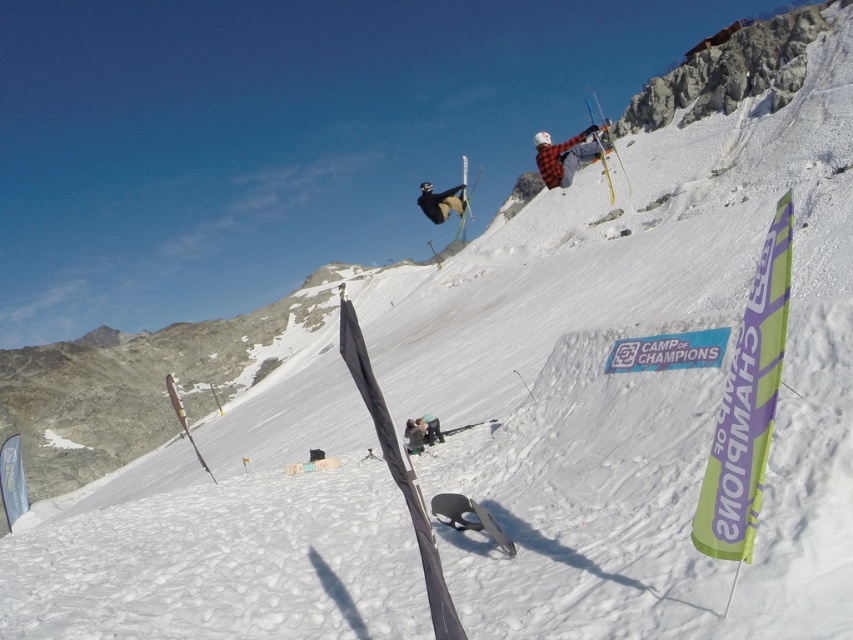
Question: Can you confirm if black matte snowboarder at upper center is bigger than matte black snowboard at center?

Choices:
 (A) yes
 (B) no

Answer: (A)

Question: Is black matte snowboarder at upper center to the left of matte black snowboard at center from the viewer's perspective?

Choices:
 (A) no
 (B) yes

Answer: (A)

Question: Is black matte snowboarder at upper center to the right of green fabric jacket at center from the viewer's perspective?

Choices:
 (A) no
 (B) yes

Answer: (B)

Question: Based on their relative distances, which object is nearer to the matte black snowboard at center?

Choices:
 (A) checkered fabric skier at upper center
 (B) matte black ski at center

Answer: (A)

Question: Which point is farther to the camera?

Choices:
 (A) (589, 109)
 (B) (418, 444)
 (C) (467, 163)

Answer: (C)

Question: Which object appears closest to the camera in this image?

Choices:
 (A) matte black snowboard at center
 (B) matte black ski at upper center
 (C) black matte snowboarder at upper center
 (D) green fabric jacket at center

Answer: (A)